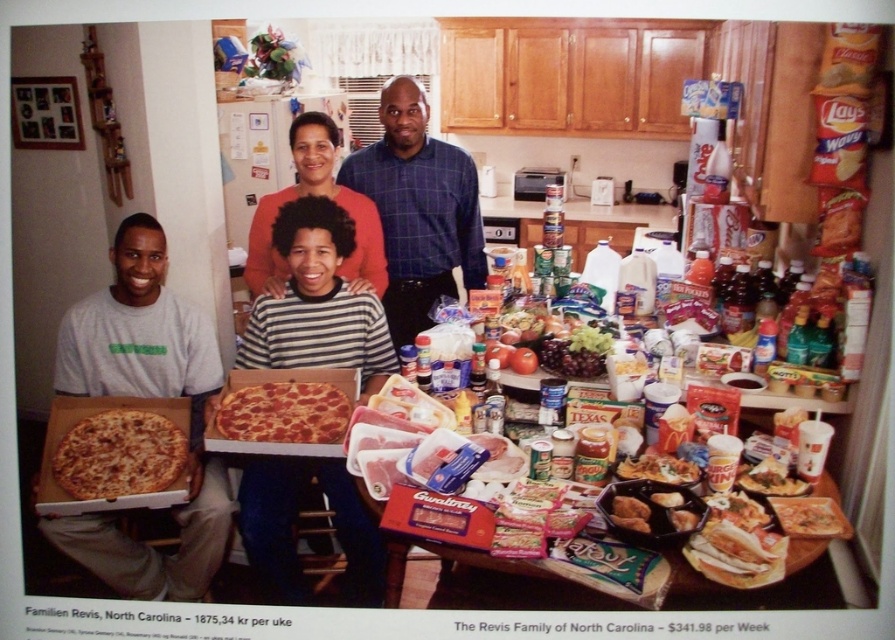
Does matte blue shirt at center appear on the right side of white matte shirt at lower left?

Correct, you'll find matte blue shirt at center to the right of white matte shirt at lower left.

Is point (113, 554) positioned behind point (109, 577)?

Yes, it is.

Which is in front, point (368, 548) or point (124, 570)?

Point (368, 548)

Identify the location of matte blue shirt at center. (147, 545).

Does blue plaid shirt at center appear under cheesy pizza at lower left?

Incorrect, blue plaid shirt at center is not positioned below cheesy pizza at lower left.

Is point (429, 300) in front of point (150, 465)?

No, (429, 300) is further to viewer.

At what (x,y) coordinates should I click in order to perform the action: click on blue plaid shirt at center. Please return your answer as a coordinate pair (x, y). Looking at the image, I should click on coord(418,209).

Does matte blue shirt at center have a lesser width compared to blue plaid shirt at center?

Incorrect, matte blue shirt at center's width is not less than blue plaid shirt at center's.

Is point (311, 112) more distant than point (478, 204)?

No, (311, 112) is closer to viewer.

Where is `matte blue shirt at center`? The image size is (895, 640). matte blue shirt at center is located at coordinates (147, 545).